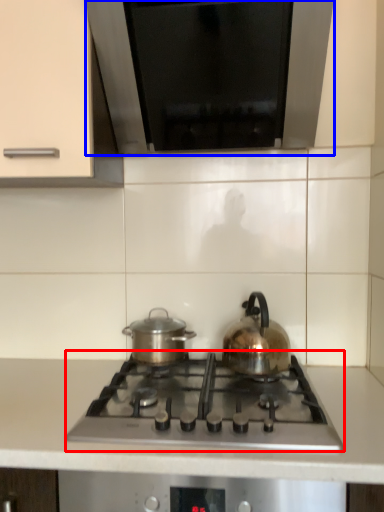
Question: Among these objects, which one is farthest to the camera, gas stove (highlighted by a red box) or exhaust hood (highlighted by a blue box)?

Choices:
 (A) gas stove
 (B) exhaust hood

Answer: (B)